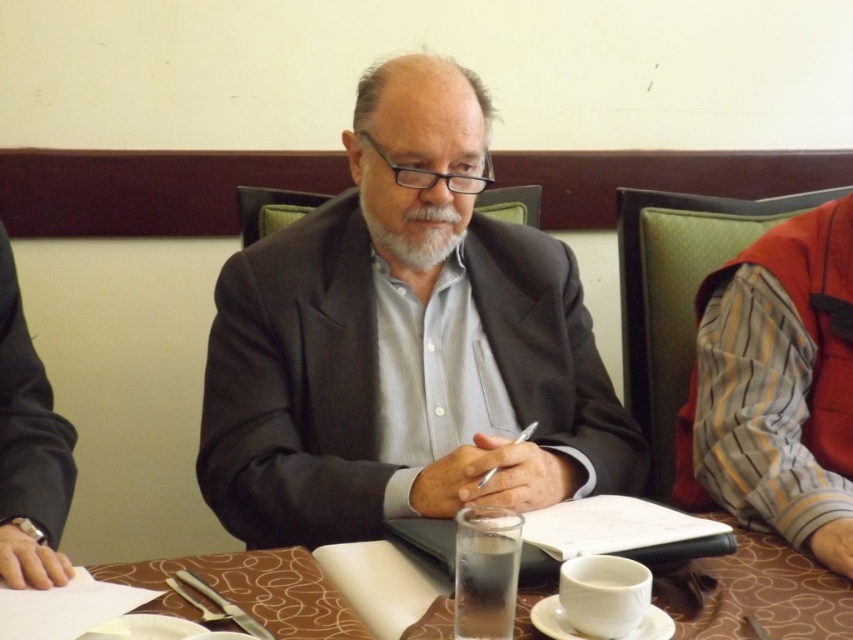
Question: Which point is closer to the camera?

Choices:
 (A) (4, 435)
 (B) (450, 227)
 (C) (569, 600)

Answer: (C)

Question: Among these objects, which one is nearest to the camera?

Choices:
 (A) matte gray suit at center
 (B) black smooth suit at left

Answer: (B)

Question: Is matte gray suit at center thinner than white ceramic cup at center?

Choices:
 (A) no
 (B) yes

Answer: (A)

Question: Can you confirm if black smooth suit at left is bigger than white ceramic cup at center?

Choices:
 (A) no
 (B) yes

Answer: (B)

Question: Which of these objects is positioned farthest from the matte gray suit at center?

Choices:
 (A) brown textured table at center
 (B) black smooth suit at left
 (C) white matte beard at center

Answer: (B)

Question: Is matte gray suit at center closer to camera compared to black smooth suit at left?

Choices:
 (A) no
 (B) yes

Answer: (A)